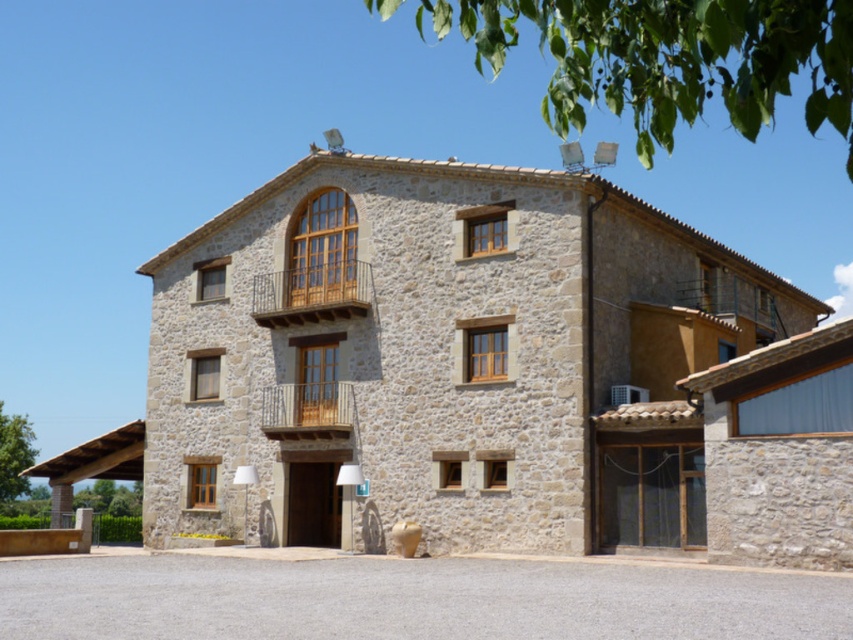
How much distance is there between wooden at upper center and wooden at center?

The distance of wooden at upper center from wooden at center is 3.29 meters.

Based on the photo, is the position of wooden at upper center less distant than that of wooden at center?

No.

Find the location of a particular element. Image resolution: width=853 pixels, height=640 pixels. wooden at upper center is located at coordinates (310, 292).

This screenshot has width=853, height=640. I want to click on wooden at upper center, so click(x=310, y=292).